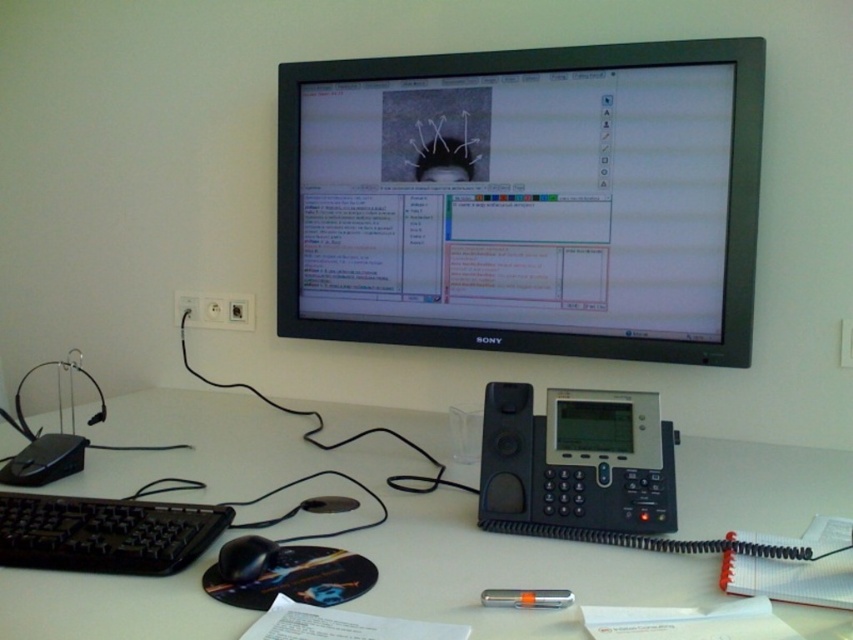
Question: Which of these objects is positioned farthest from the white matte table at center?

Choices:
 (A) black glossy monitor at upper center
 (B) black matte mouse at lower center
 (C) black plastic speaker at center
 (D) metallic silver pen at center

Answer: (D)

Question: Observing the image, what is the correct spatial positioning of white matte table at center in reference to black plastic keyboard at lower left?

Choices:
 (A) below
 (B) above

Answer: (A)

Question: Can you confirm if black plastic keyboard at lower left is bigger than black matte mouse at lower center?

Choices:
 (A) no
 (B) yes

Answer: (B)

Question: Which object is farther from the camera taking this photo?

Choices:
 (A) white matte table at center
 (B) black glossy monitor at upper center
 (C) black plastic speaker at center

Answer: (B)

Question: Does white matte table at center appear under black plastic speaker at center?

Choices:
 (A) no
 (B) yes

Answer: (B)

Question: Which point appears farthest from the camera in this image?

Choices:
 (A) (712, 458)
 (B) (54, 557)
 (C) (258, 572)
 (D) (494, 602)

Answer: (A)